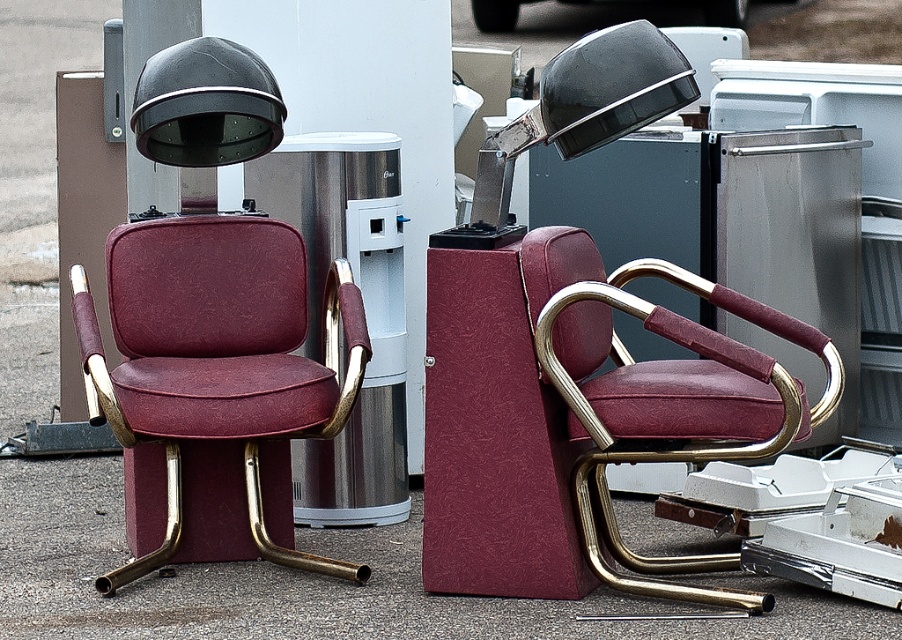
You are standing at the entrance of the outdoor barber setup and need to move towards the maroon leather swivel chair at center. Which direction should you walk to reach it?

The maroon leather swivel chair at center is located at point [670,403], so you should walk towards the center area to reach it.